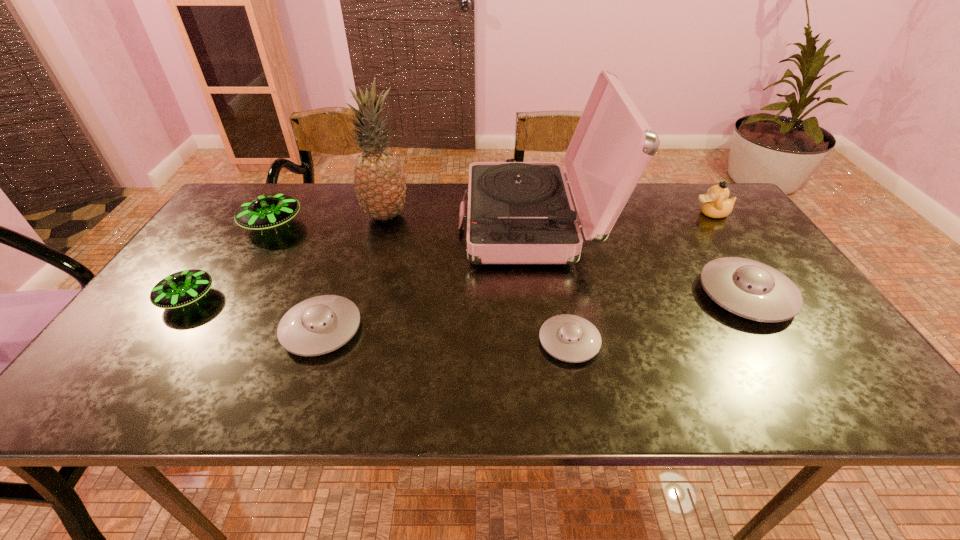
Choose which saucer is the nearest neighbor to the duckling. Please provide its 2D coordinates. Your answer should be formatted as a tuple, i.e. [(x, y)], where the tuple contains the x and y coordinates of a point satisfying the conditions above.

[(748, 288)]

At what (x,y) coordinates should I click in order to perform the action: click on gray saucer object that ranks as the second closest to the record player. Please return your answer as a coordinate pair (x, y). This screenshot has height=540, width=960. Looking at the image, I should click on (570, 338).

Locate an element on the screen. the third closest gray saucer to the third tallest object is located at coordinates (318, 325).